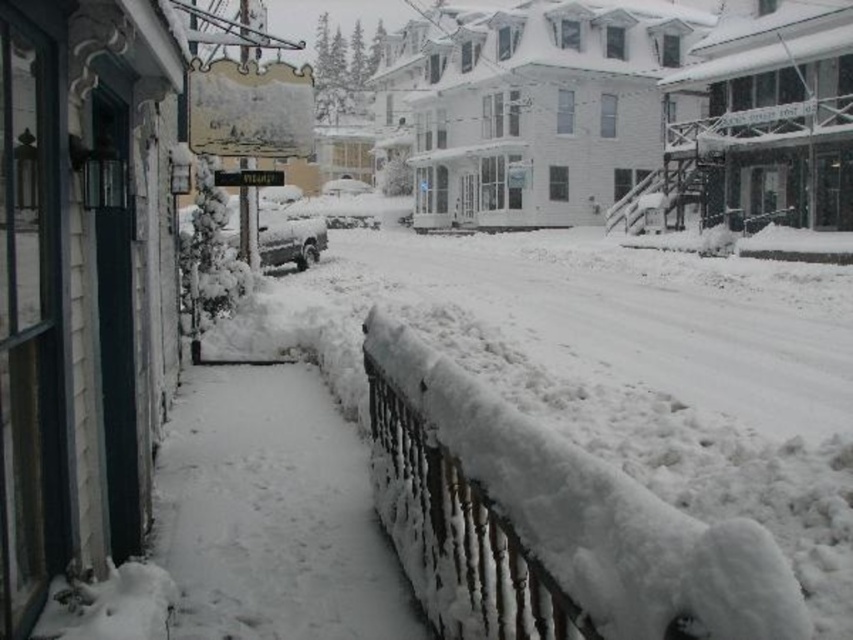
You are standing at the camera position, and you want to walk to point (318, 513). The snow on the path is 30 cm deep. Can you walk there without sinking?

The distance to point (318, 513) is 5.85 meters. Since the snow depth is 30 cm, which is relatively shallow, you can walk there without sinking.